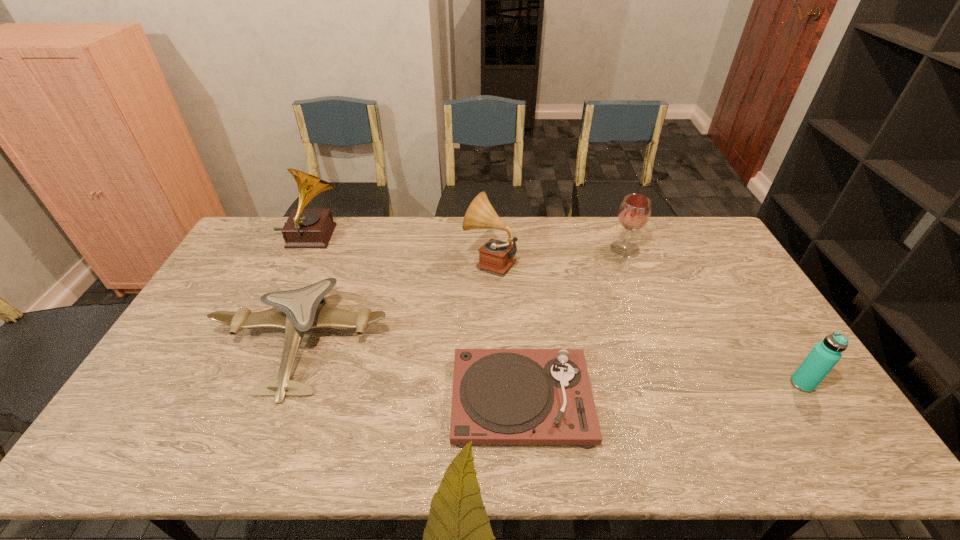
Locate an element on the screen. This screenshot has width=960, height=540. the leftmost phonograph_record is located at coordinates (305, 228).

Where is `the second shortest phonograph_record`? the second shortest phonograph_record is located at coordinates pyautogui.click(x=497, y=256).

At what (x,y) coordinates should I click in order to perform the action: click on the fifth object from left to right. Please return your answer as a coordinate pair (x, y). Looking at the image, I should click on (634, 212).

Locate an element on the screen. The width and height of the screenshot is (960, 540). the rightmost object is located at coordinates (824, 356).

Find the location of a particular element. The width and height of the screenshot is (960, 540). drone is located at coordinates (296, 311).

What are the coordinates of `the nearest phonograph_record` in the screenshot? It's located at (500, 396).

Where is `the shortest phonograph_record`? the shortest phonograph_record is located at coordinates (500, 396).

This screenshot has height=540, width=960. I want to click on vacant area situated 0.060m from the horn of the leftmost phonograph_record, so click(363, 237).

The height and width of the screenshot is (540, 960). In order to click on blank space located 0.090m on the horn of the second shortest phonograph_record in this screenshot , I will do `click(438, 260)`.

I want to click on free space located 0.240m on the horn of the second shortest phonograph_record, so click(x=395, y=260).